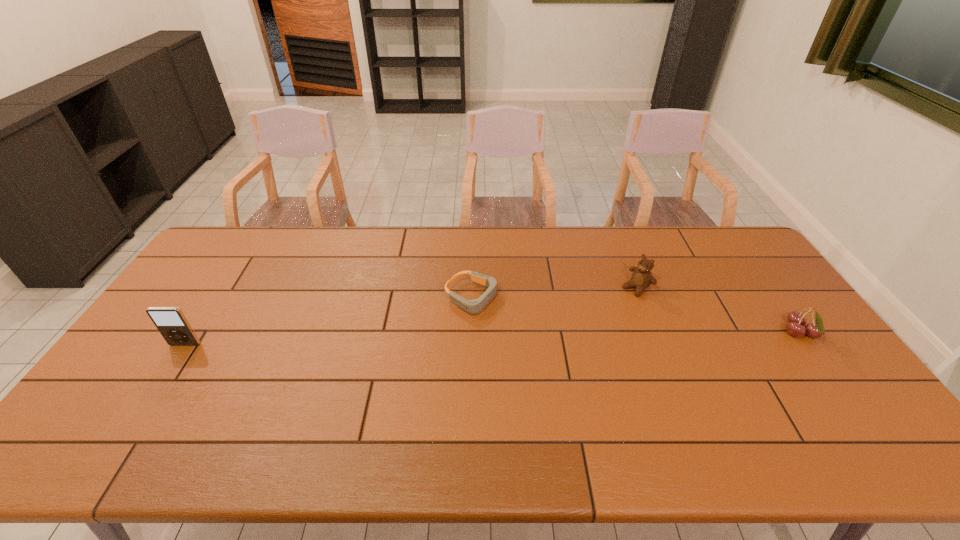
In the image, there is a desktop. Where is `vacant area at the right edge`? The image size is (960, 540). vacant area at the right edge is located at coordinates (727, 282).

I want to click on free space at the far left corner of the desktop, so click(236, 230).

In the image, there is a desktop. At what (x,y) coordinates should I click in order to perform the action: click on vacant space at the near right corner. Please return your answer as a coordinate pair (x, y). The height and width of the screenshot is (540, 960). Looking at the image, I should click on (867, 410).

Image resolution: width=960 pixels, height=540 pixels. Identify the location of empty location between the third shortest object and the leftmost object. (411, 316).

You are a GUI agent. You are given a task and a screenshot of the screen. Output one action in this format:
    pyautogui.click(x=<x>, y=<y>)
    Task: Click on the vacant area between the second tallest object and the third tallest object
    
    Given the screenshot: What is the action you would take?
    pyautogui.click(x=718, y=310)

Find the location of `vacant region between the third object from right to left and the leftmost object`. vacant region between the third object from right to left and the leftmost object is located at coordinates (329, 321).

Find the location of a particular element. vacant area between the cherry and the iPod is located at coordinates (492, 339).

You are a GUI agent. You are given a task and a screenshot of the screen. Output one action in this format:
    pyautogui.click(x=<x>, y=<y>)
    Task: Click on the vacant area that lies between the second tallest object and the second shortest object
    
    Given the screenshot: What is the action you would take?
    pyautogui.click(x=718, y=310)

Where is `empty location between the shortest object and the iPod`? empty location between the shortest object and the iPod is located at coordinates (329, 321).

I want to click on vacant area that lies between the iPod and the goggles, so click(329, 321).